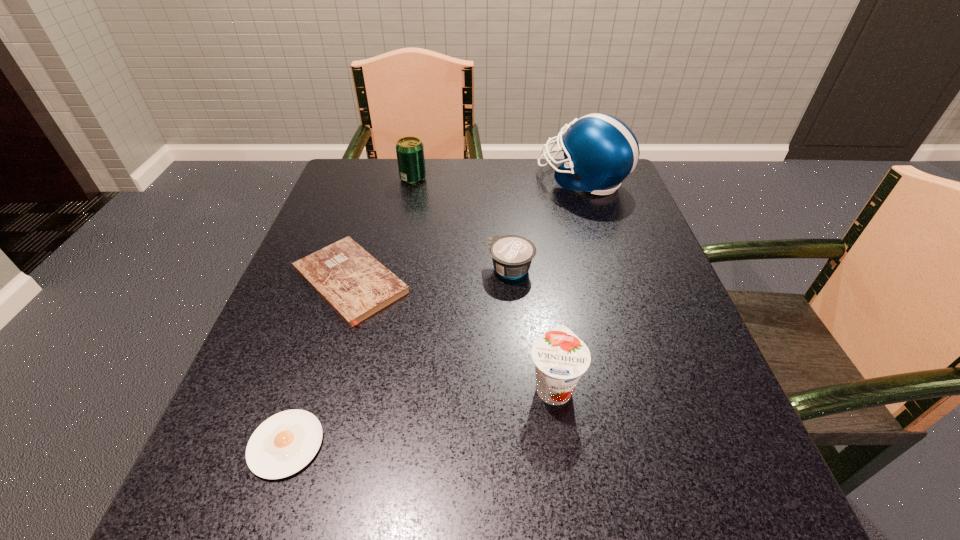
The image size is (960, 540). In order to click on vacant space located at the front of the football helmet with the faceguard in this screenshot , I will do `click(397, 180)`.

Identify the location of free location located on the back of the beer can. (417, 161).

Identify the location of vacant area situated on the back of the nearer yogurt. Image resolution: width=960 pixels, height=540 pixels. (540, 289).

You are a GUI agent. You are given a task and a screenshot of the screen. Output one action in this format:
    pyautogui.click(x=<x>, y=<y>)
    Task: Click on the vacant space situated on the left of the shorter yogurt
    
    Given the screenshot: What is the action you would take?
    pyautogui.click(x=301, y=269)

Where is `vacant space located on the right of the second shortest object`? The height and width of the screenshot is (540, 960). vacant space located on the right of the second shortest object is located at coordinates (563, 281).

Where is `vacant space located on the back of the egg yolk`? vacant space located on the back of the egg yolk is located at coordinates (348, 258).

The image size is (960, 540). I want to click on football helmet that is at the far edge, so coord(600,151).

Image resolution: width=960 pixels, height=540 pixels. Find the location of `beer can present at the far edge`. beer can present at the far edge is located at coordinates click(410, 151).

Find the location of a particular element. This screenshot has width=960, height=540. object at the near edge is located at coordinates (282, 445).

The height and width of the screenshot is (540, 960). I want to click on Bible that is at the left edge, so click(351, 281).